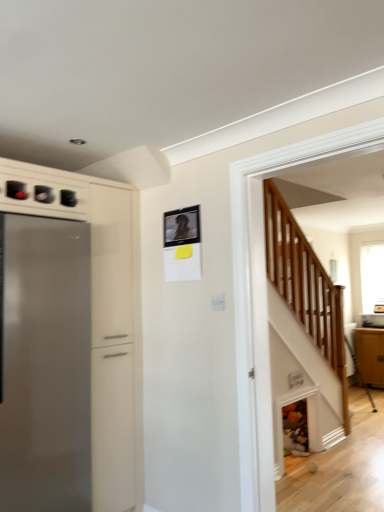
Question: Considering the relative sizes of matte black picture frame at upper center and satin silver refrigerator at left in the image provided, is matte black picture frame at upper center shorter than satin silver refrigerator at left?

Choices:
 (A) yes
 (B) no

Answer: (A)

Question: Does matte black picture frame at upper center come behind satin silver refrigerator at left?

Choices:
 (A) no
 (B) yes

Answer: (B)

Question: Can you confirm if matte black picture frame at upper center is positioned to the right of satin silver refrigerator at left?

Choices:
 (A) yes
 (B) no

Answer: (A)

Question: Could you tell me if matte black picture frame at upper center is facing satin silver refrigerator at left?

Choices:
 (A) no
 (B) yes

Answer: (A)

Question: Is matte black picture frame at upper center completely or partially outside of satin silver refrigerator at left?

Choices:
 (A) no
 (B) yes

Answer: (B)

Question: Based on their sizes in the image, would you say clear glass window at upper right is bigger or smaller than matte brown cabinet at right?

Choices:
 (A) big
 (B) small

Answer: (B)

Question: Considering the positions of clear glass window at upper right and matte brown cabinet at right in the image, is clear glass window at upper right wider or thinner than matte brown cabinet at right?

Choices:
 (A) wide
 (B) thin

Answer: (B)

Question: Based on their positions, is clear glass window at upper right located to the left or right of matte brown cabinet at right?

Choices:
 (A) right
 (B) left

Answer: (A)

Question: From the image's perspective, relative to matte brown cabinet at right, is clear glass window at upper right above or below?

Choices:
 (A) below
 (B) above

Answer: (B)

Question: From a real-world perspective, is clear glass window at upper right physically located above or below satin silver refrigerator at left?

Choices:
 (A) above
 (B) below

Answer: (A)

Question: Which is correct: clear glass window at upper right is inside satin silver refrigerator at left, or outside of it?

Choices:
 (A) outside
 (B) inside

Answer: (A)

Question: Considering the positions of point (367, 295) and point (24, 446), is point (367, 295) closer or farther from the camera than point (24, 446)?

Choices:
 (A) closer
 (B) farther

Answer: (B)

Question: From the image's perspective, is clear glass window at upper right above or below satin silver refrigerator at left?

Choices:
 (A) above
 (B) below

Answer: (A)

Question: Would you say clear glass window at upper right is to the left or to the right of matte black picture frame at upper center in the picture?

Choices:
 (A) right
 (B) left

Answer: (A)

Question: Considering the positions of clear glass window at upper right and matte black picture frame at upper center in the image, is clear glass window at upper right taller or shorter than matte black picture frame at upper center?

Choices:
 (A) tall
 (B) short

Answer: (A)